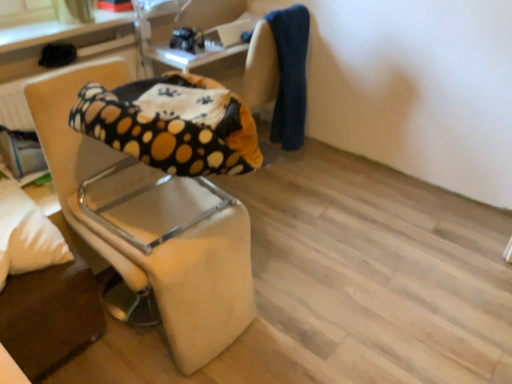
Where is `spots to the right of beige fabric chair at left`? The height and width of the screenshot is (384, 512). spots to the right of beige fabric chair at left is located at coordinates (282, 298).